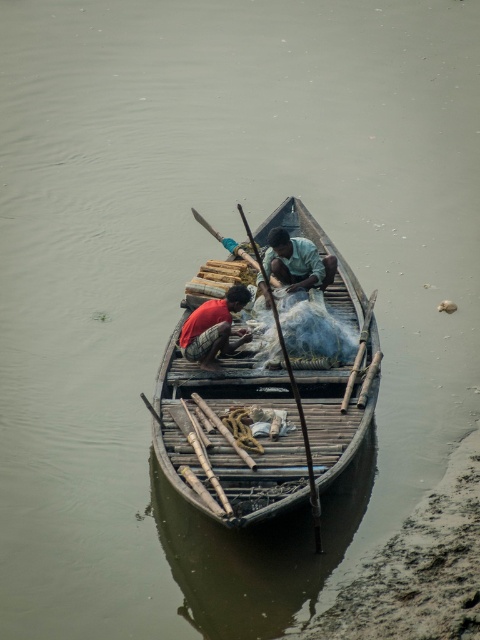
Does red fabric shirt at center have a greater height compared to light blue fabric at center?

No.

Is red fabric shirt at center below light blue fabric at center?

Correct, red fabric shirt at center is located below light blue fabric at center.

What are the coordinates of `red fabric shirt at center` in the screenshot? It's located at (214, 328).

What are the coordinates of `red fabric shirt at center` in the screenshot? It's located at (214, 328).

Consider the image. Between wooden boat at center and wooden paddle at center, which one appears on the left side from the viewer's perspective?

From the viewer's perspective, wooden paddle at center appears more on the left side.

Can you confirm if wooden boat at center is positioned above wooden paddle at center?

Incorrect, wooden boat at center is not positioned above wooden paddle at center.

The image size is (480, 640). I want to click on wooden boat at center, so click(x=227, y=436).

Between wooden boat at center and light blue fabric at center, which one is positioned higher?

light blue fabric at center is higher up.

Is wooden boat at center in front of light blue fabric at center?

Yes, it is in front of light blue fabric at center.

Who is more distant from viewer, (354, 451) or (328, 269)?

Positioned behind is point (328, 269).

You are a GUI agent. You are given a task and a screenshot of the screen. Output one action in this format:
    pyautogui.click(x=<x>, y=<y>)
    Task: Click on the wooden boat at center
    The height and width of the screenshot is (640, 480).
    Given the screenshot: What is the action you would take?
    pyautogui.click(x=227, y=436)